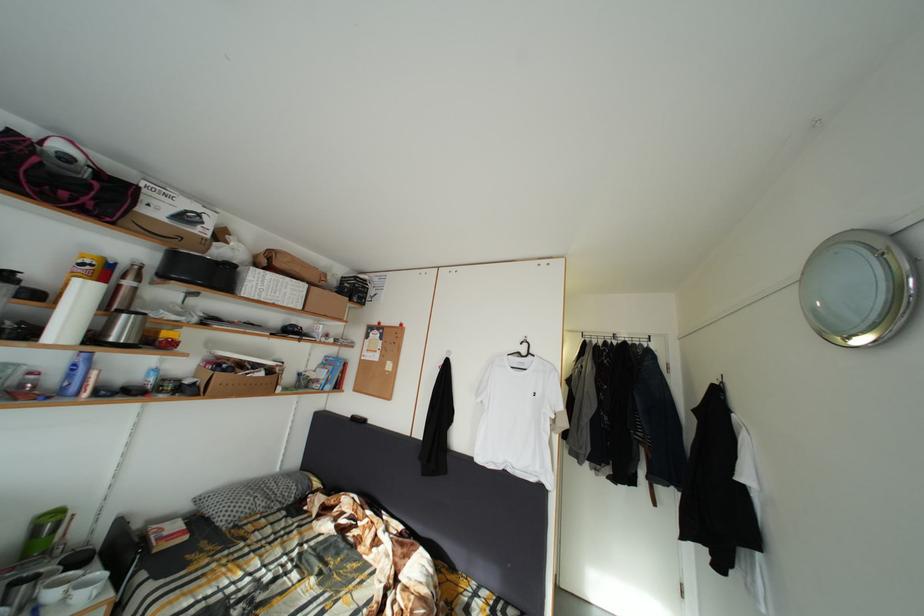
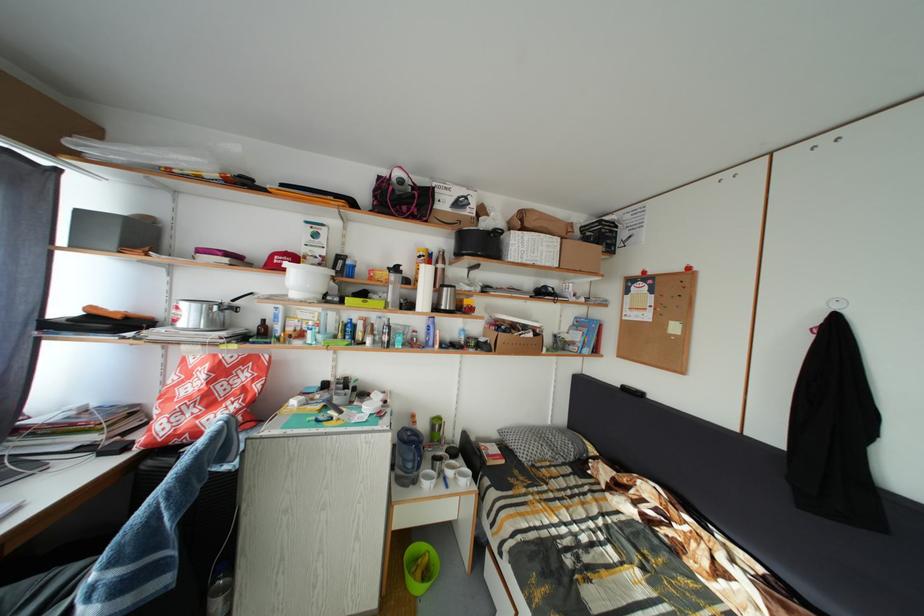
Question: Based on the continuous images, in which direction is the camera rotating? Reply with the corresponding letter.

Choices:
 (A) Left
 (B) Right
 (C) Up
 (D) Down

Answer: (A)